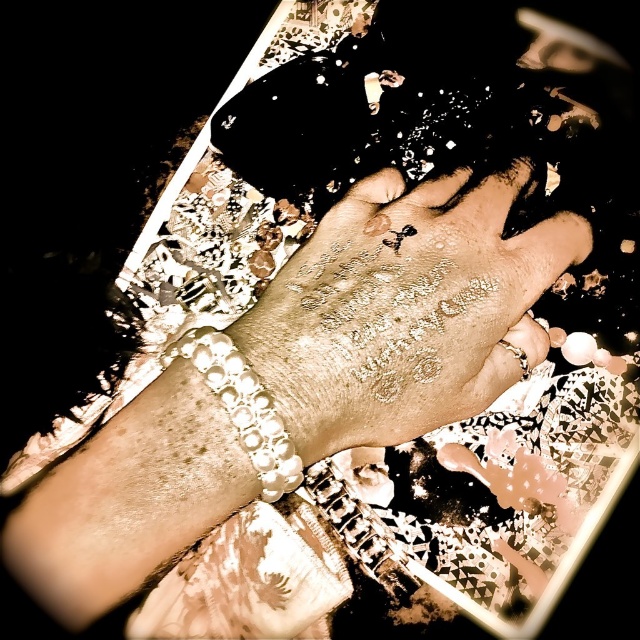
Question: Observing the image, what is the correct spatial positioning of gold glittery hand at center in reference to pearl-like bracelet at lower left?

Choices:
 (A) below
 (B) above

Answer: (B)

Question: Can you confirm if gold glittery hand at center is smaller than pearl-like bracelet at lower left?

Choices:
 (A) no
 (B) yes

Answer: (A)

Question: Does gold glittery hand at center appear under pearl-like bracelet at lower left?

Choices:
 (A) yes
 (B) no

Answer: (B)